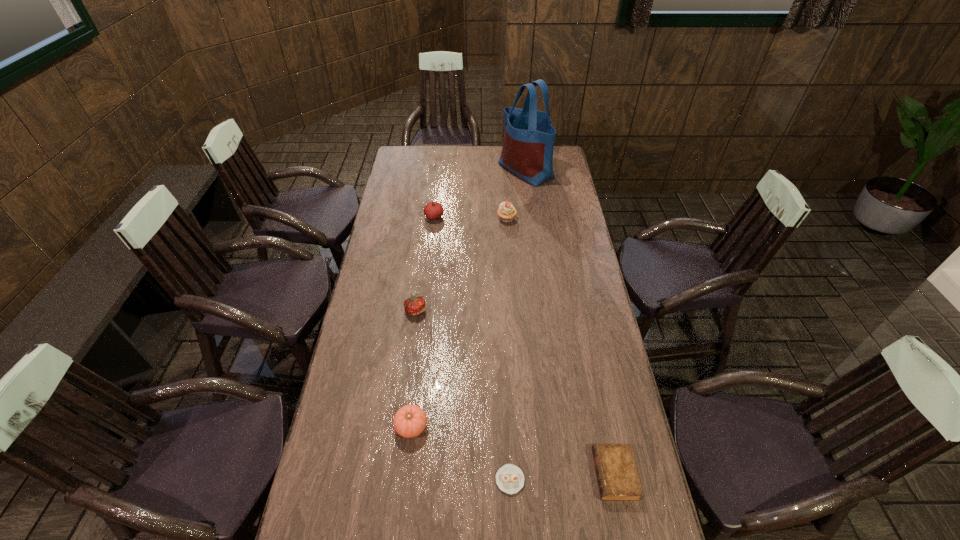
Where is `the shortest object`? the shortest object is located at coordinates (509, 478).

Where is `vacant region located 0.140m on the left of the handbag`? The height and width of the screenshot is (540, 960). vacant region located 0.140m on the left of the handbag is located at coordinates (472, 170).

This screenshot has height=540, width=960. In order to click on vacant region located 0.260m on the front of the farther cupcake in this screenshot , I will do `click(510, 265)`.

You are a GUI agent. You are given a task and a screenshot of the screen. Output one action in this format:
    pyautogui.click(x=<x>, y=<y>)
    Task: Click on the free space located on the front of the tallest tomato
    This screenshot has height=540, width=960.
    Given the screenshot: What is the action you would take?
    pyautogui.click(x=432, y=237)

The height and width of the screenshot is (540, 960). I want to click on vacant space located 0.080m on the back of the nearest tomato, so click(x=416, y=388).

Locate an element on the screen. This screenshot has height=540, width=960. free spot located on the front of the fourth farthest object is located at coordinates pos(409,363).

What are the coordinates of `free space located 0.090m on the spine side of the second shortest object` in the screenshot? It's located at (563, 474).

I want to click on free point located on the spine side of the second shortest object, so click(x=470, y=474).

The height and width of the screenshot is (540, 960). What are the coordinates of `vacant area situated 0.270m on the spine side of the second shortest object` in the screenshot? It's located at (499, 474).

Locate an element on the screen. free space located 0.080m on the left of the shortest object is located at coordinates (467, 480).